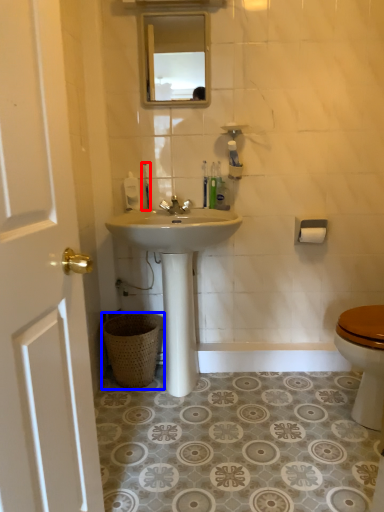
Question: Which object is further to the camera taking this photo, toothbrush (highlighted by a red box) or trash bin/can (highlighted by a blue box)?

Choices:
 (A) toothbrush
 (B) trash bin/can

Answer: (A)